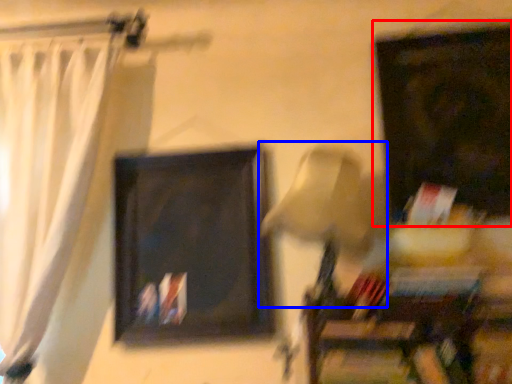
Question: Which point is closer to the camera, picture frame (highlighted by a red box) or table lamp (highlighted by a blue box)?

Choices:
 (A) picture frame
 (B) table lamp

Answer: (B)